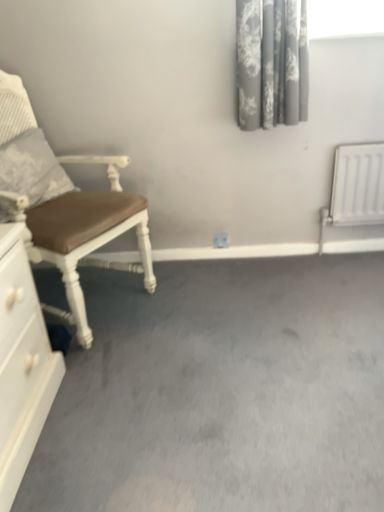
Question: Considering the positions of point (253, 62) and point (18, 162), is point (253, 62) closer or farther from the camera than point (18, 162)?

Choices:
 (A) closer
 (B) farther

Answer: (B)

Question: Is gray floral fabric curtain at upper right in front of or behind brown leather chair at left in the image?

Choices:
 (A) behind
 (B) front

Answer: (A)

Question: Estimate the real-world distances between objects in this image. Which object is farther from the brown leather chair at left?

Choices:
 (A) white glossy chest of drawers at lower left
 (B) gray floral fabric curtain at upper right
 (C) gray carpet at center
 (D) textured gray pillow at left

Answer: (B)

Question: Which object is the closest to the textured gray pillow at left?

Choices:
 (A) gray floral fabric curtain at upper right
 (B) white glossy chest of drawers at lower left
 (C) brown leather chair at left
 (D) gray carpet at center

Answer: (C)